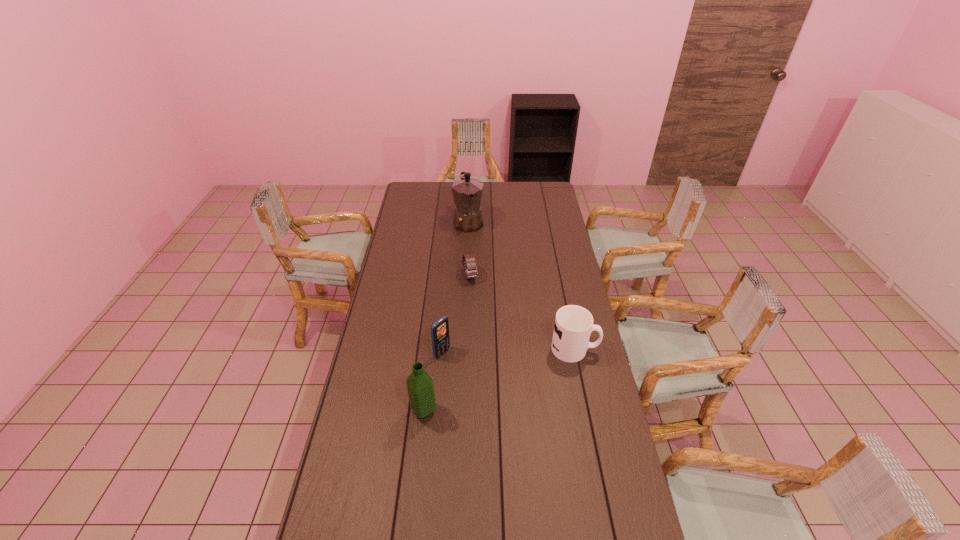
Where is `free space located on the pouring side of the farthest object`? Image resolution: width=960 pixels, height=540 pixels. free space located on the pouring side of the farthest object is located at coordinates [474, 244].

I want to click on vacant region located on the pouring side of the farthest object, so (x=483, y=267).

The height and width of the screenshot is (540, 960). What are the coordinates of `vacant space located 0.280m on the screen of the cellular telephone` in the screenshot? It's located at (x=503, y=399).

The height and width of the screenshot is (540, 960). Identify the location of vacant space located on the screen of the cellular telephone. [x=519, y=410].

Identify the location of vacant space located on the screen of the cellular telephone. Image resolution: width=960 pixels, height=540 pixels. (476, 379).

You are a GUI agent. You are given a task and a screenshot of the screen. Output one action in this format:
    pyautogui.click(x=<x>, y=<y>)
    Task: Click on the free location located on the face of the watch
    The height and width of the screenshot is (540, 960).
    Given the screenshot: What is the action you would take?
    pyautogui.click(x=479, y=306)

At what (x,y) coordinates should I click in order to perform the action: click on free region located on the face of the watch. Please return your answer as a coordinate pair (x, y). The width and height of the screenshot is (960, 540). Looking at the image, I should click on (475, 297).

Image resolution: width=960 pixels, height=540 pixels. Find the location of `free region located on the face of the watch`. free region located on the face of the watch is located at coordinates (482, 316).

The height and width of the screenshot is (540, 960). I want to click on object that is at the right edge, so click(x=573, y=325).

Where is `vacant point at the far edge`? The width and height of the screenshot is (960, 540). vacant point at the far edge is located at coordinates (525, 200).